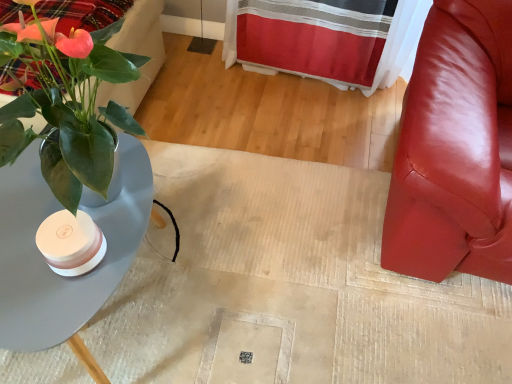
The width and height of the screenshot is (512, 384). Identify the location of vacant space to the right of matte gray table at left. (258, 273).